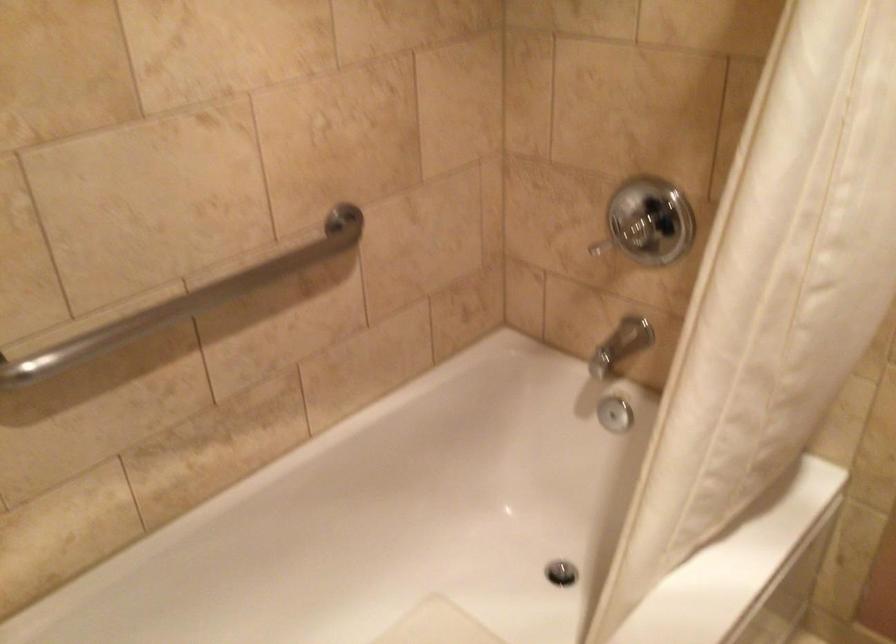
The width and height of the screenshot is (896, 644). Describe the element at coordinates (621, 345) in the screenshot. I see `the faucet diverter knob` at that location.